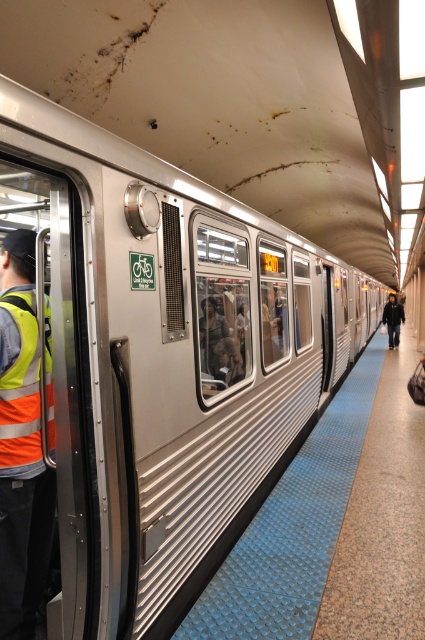
Question: Is high-visibility fabric safety vest at left positioned behind dark gray jacket at right?

Choices:
 (A) yes
 (B) no

Answer: (B)

Question: Is high-visibility fabric safety vest at left wider than dark gray jacket at right?

Choices:
 (A) no
 (B) yes

Answer: (A)

Question: Can you confirm if high-visibility fabric safety vest at left is positioned above dark gray jacket at right?

Choices:
 (A) no
 (B) yes

Answer: (A)

Question: Which point is closer to the camera?

Choices:
 (A) (48, 355)
 (B) (390, 342)

Answer: (A)